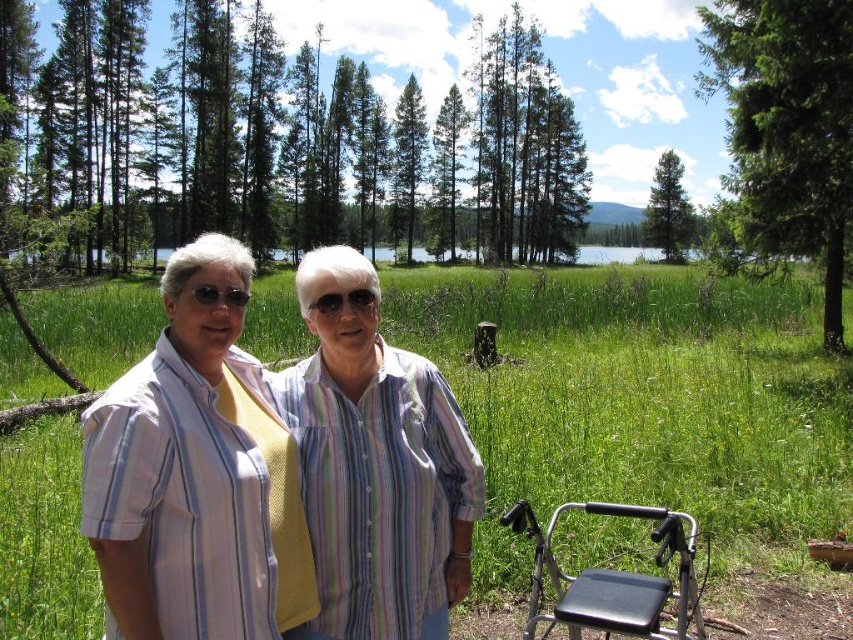
Question: Is green leafy trees at upper center thinner than green leafy tree at upper right?

Choices:
 (A) yes
 (B) no

Answer: (B)

Question: Which point is closer to the camera?

Choices:
 (A) black plastic folding chair at lower right
 (B) green leafy tree at upper right
 (C) green matte tree at upper center
 (D) green leafy trees at upper center

Answer: (A)

Question: Which object is farther from the camera taking this photo?

Choices:
 (A) black plastic folding chair at lower right
 (B) green leafy trees at upper center
 (C) striped cotton shirt at center

Answer: (B)

Question: In this image, where is striped cotton shirt at center located relative to green matte tree at upper center?

Choices:
 (A) above
 (B) below

Answer: (B)

Question: Is striped cotton shirt at center thinner than green matte tree at upper center?

Choices:
 (A) no
 (B) yes

Answer: (B)

Question: Which of the following is the closest to the observer?

Choices:
 (A) green matte tree at upper center
 (B) green leafy tree at upper right

Answer: (B)